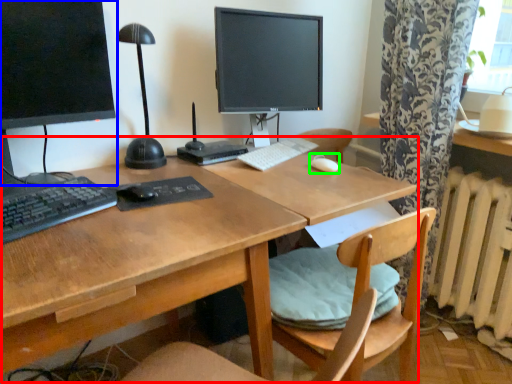
Question: Estimate the real-world distances between objects in this image. Which object is farther from desk (highlighted by a red box), computer monitor (highlighted by a blue box) or mouse (highlighted by a green box)?

Choices:
 (A) computer monitor
 (B) mouse

Answer: (B)